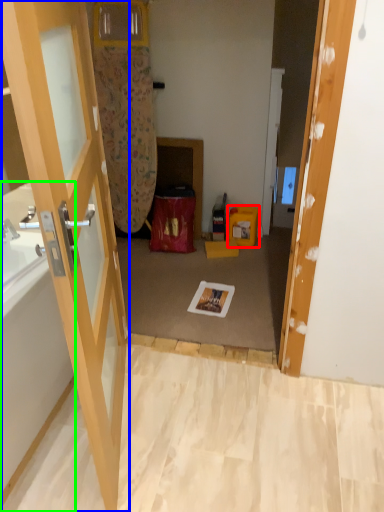
Question: Which object is the farthest from box (highlighted by a red box)? Choose among these: door (highlighted by a blue box) or bathtub (highlighted by a green box).

Choices:
 (A) door
 (B) bathtub

Answer: (B)